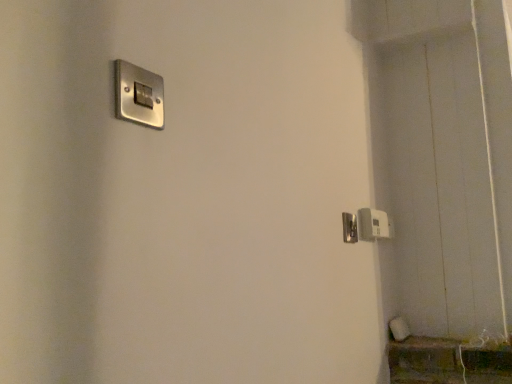
Locate an element on the screen. satin silver switch at upper left, which is the 2th light switch in bottom-to-top order is located at coordinates (138, 95).

Find the location of a particular element. The width and height of the screenshot is (512, 384). satin silver switch at upper left, positioned as the 1th light switch in left-to-right order is located at coordinates (138, 95).

Is satin nickel door handle at right in front of satin silver switch at upper left, positioned as the second light switch in right-to-left order?

No.

From a real-world perspective, is satin nickel door handle at right beneath satin silver switch at upper left, the 1th light switch in the top-to-bottom sequence?

Yes, from a real-world perspective, satin nickel door handle at right is under satin silver switch at upper left, the 1th light switch in the top-to-bottom sequence.

This screenshot has width=512, height=384. Identify the location of door handle on the right of the satin silver switch at upper left, the 1th light switch in the top-to-bottom sequence. [x=349, y=228].

Is satin nickel door handle at right wider or thinner than satin silver switch at upper left, positioned as the 1th light switch in left-to-right order?

satin nickel door handle at right is thinner than satin silver switch at upper left, positioned as the 1th light switch in left-to-right order.

Is satin silver switch at upper left, positioned as the 1th light switch in front-to-back order, wider or thinner than satin nickel door handle at right?

Considering their sizes, satin silver switch at upper left, positioned as the 1th light switch in front-to-back order, looks broader than satin nickel door handle at right.

How distant is satin silver switch at upper left, the 1th light switch in the top-to-bottom sequence, from satin nickel door handle at right?

satin silver switch at upper left, the 1th light switch in the top-to-bottom sequence, and satin nickel door handle at right are 31.18 inches apart from each other.

Can you confirm if satin silver switch at upper left, positioned as the second light switch in right-to-left order, is taller than satin nickel door handle at right?

Incorrect, the height of satin silver switch at upper left, positioned as the second light switch in right-to-left order, is not larger of that of satin nickel door handle at right.

Is satin silver switch at upper left, marked as the second light switch in a back-to-front arrangement, looking in the opposite direction of satin nickel door handle at right?

No, satin nickel door handle at right is not at the back of satin silver switch at upper left, marked as the second light switch in a back-to-front arrangement.

How many degrees apart are the facing directions of satin silver switch at upper left, which is the 2th light switch in bottom-to-top order, and white plastic light switch at lower right, arranged as the second light switch when viewed from the top?

The angle between the facing direction of satin silver switch at upper left, which is the 2th light switch in bottom-to-top order, and the facing direction of white plastic light switch at lower right, arranged as the second light switch when viewed from the top, is 1.55 degrees.

Based on the photo, is satin silver switch at upper left, which is the 2th light switch in bottom-to-top order, not inside white plastic light switch at lower right, the 1th light switch in the right-to-left sequence?

Yes.

Is satin silver switch at upper left, which is the 2th light switch in bottom-to-top order, far away from white plastic light switch at lower right, the first light switch from the bottom?

No, satin silver switch at upper left, which is the 2th light switch in bottom-to-top order, is not far away from white plastic light switch at lower right, the first light switch from the bottom.

Between satin silver switch at upper left, marked as the second light switch in a back-to-front arrangement, and white plastic light switch at lower right, positioned as the second light switch in front-to-back order, which one has smaller size?

satin silver switch at upper left, marked as the second light switch in a back-to-front arrangement.

Do you think white plastic light switch at lower right, arranged as the second light switch when viewed from the top, is within satin nickel door handle at right, or outside of it?

The correct answer is: outside.

Is white plastic light switch at lower right, the 1th light switch in the right-to-left sequence, shorter than satin nickel door handle at right?

In fact, white plastic light switch at lower right, the 1th light switch in the right-to-left sequence, may be taller than satin nickel door handle at right.

Which of these two, white plastic light switch at lower right, positioned as the 2th light switch in left-to-right order, or satin nickel door handle at right, is bigger?

Bigger between the two is white plastic light switch at lower right, positioned as the 2th light switch in left-to-right order.

From the image's perspective, is white plastic light switch at lower right, arranged as the second light switch when viewed from the top, above satin nickel door handle at right?

No, from the image's perspective, white plastic light switch at lower right, arranged as the second light switch when viewed from the top, is not over satin nickel door handle at right.

From the picture: From the image's perspective, between satin nickel door handle at right and white plastic light switch at lower right, positioned as the 2th light switch in left-to-right order, which one is located above?

satin nickel door handle at right, from the image's perspective.

In order to click on the 1st light switch positioned above the satin nickel door handle at right (from a real-world perspective) in this screenshot , I will do `click(374, 224)`.

Based on the photo, from a real-world perspective, who is located higher, satin nickel door handle at right or white plastic light switch at lower right, the 1th light switch in the right-to-left sequence?

From a 3D spatial view, white plastic light switch at lower right, the 1th light switch in the right-to-left sequence, is above.

How distant is satin nickel door handle at right from white plastic light switch at lower right, the first light switch positioned from the back?

They are 4.10 inches apart.

Is white plastic light switch at lower right, positioned as the 2th light switch in left-to-right order, positioned with its back to satin silver switch at upper left, positioned as the 1th light switch in front-to-back order?

No, white plastic light switch at lower right, positioned as the 2th light switch in left-to-right order, is not facing the opposite direction of satin silver switch at upper left, positioned as the 1th light switch in front-to-back order.

Considering the sizes of objects white plastic light switch at lower right, positioned as the second light switch in front-to-back order, and satin silver switch at upper left, the 1th light switch in the top-to-bottom sequence, in the image provided, who is thinner, white plastic light switch at lower right, positioned as the second light switch in front-to-back order, or satin silver switch at upper left, the 1th light switch in the top-to-bottom sequence,?

satin silver switch at upper left, the 1th light switch in the top-to-bottom sequence.

Is white plastic light switch at lower right, the 1th light switch in the right-to-left sequence, not near satin silver switch at upper left, marked as the second light switch in a back-to-front arrangement?

white plastic light switch at lower right, the 1th light switch in the right-to-left sequence, is near satin silver switch at upper left, marked as the second light switch in a back-to-front arrangement, not far away.

Image resolution: width=512 pixels, height=384 pixels. Identify the location of light switch on the left of satin nickel door handle at right. (138, 95).

The image size is (512, 384). I want to click on door handle directly beneath the satin silver switch at upper left, the 1th light switch in the top-to-bottom sequence (from a real-world perspective), so click(x=349, y=228).

Looking at the image, which one is located closer to satin silver switch at upper left, positioned as the second light switch in right-to-left order, white plastic light switch at lower right, arranged as the second light switch when viewed from the top, or satin nickel door handle at right?

The object closer to satin silver switch at upper left, positioned as the second light switch in right-to-left order, is satin nickel door handle at right.

Based on their spatial positions, is satin nickel door handle at right or satin silver switch at upper left, positioned as the 1th light switch in left-to-right order, further from white plastic light switch at lower right, the first light switch from the bottom?

satin silver switch at upper left, positioned as the 1th light switch in left-to-right order, is further to white plastic light switch at lower right, the first light switch from the bottom.

Considering their positions, is satin silver switch at upper left, positioned as the 1th light switch in left-to-right order, positioned further to white plastic light switch at lower right, the first light switch from the bottom, than satin nickel door handle at right?

Based on the image, satin silver switch at upper left, positioned as the 1th light switch in left-to-right order, appears to be further to white plastic light switch at lower right, the first light switch from the bottom.

Which object lies nearer to the anchor point satin nickel door handle at right, satin silver switch at upper left, positioned as the 1th light switch in front-to-back order, or white plastic light switch at lower right, positioned as the second light switch in front-to-back order?

white plastic light switch at lower right, positioned as the second light switch in front-to-back order, is closer to satin nickel door handle at right.

Looking at the image, which one is located closer to satin silver switch at upper left, which is the 2th light switch in bottom-to-top order, satin nickel door handle at right or white plastic light switch at lower right, positioned as the 2th light switch in left-to-right order?

satin nickel door handle at right.

Based on their spatial positions, is white plastic light switch at lower right, positioned as the 2th light switch in left-to-right order, or satin silver switch at upper left, positioned as the second light switch in right-to-left order, further from satin nickel door handle at right?

satin silver switch at upper left, positioned as the second light switch in right-to-left order, is further to satin nickel door handle at right.

Identify the location of door handle between satin silver switch at upper left, positioned as the 1th light switch in left-to-right order, and white plastic light switch at lower right, the 1th light switch in the right-to-left sequence, along the z-axis. The height and width of the screenshot is (384, 512). pyautogui.click(x=349, y=228).